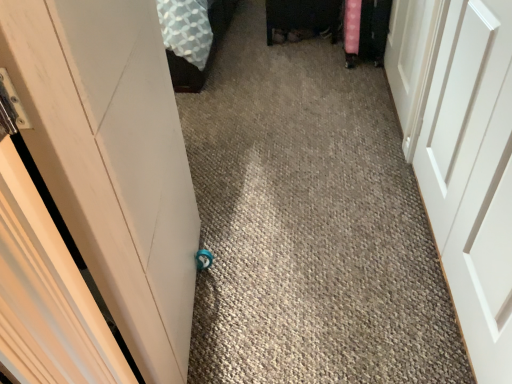
Where is `white matte door at center, which appears as the second door when viewed from the right`? The image size is (512, 384). white matte door at center, which appears as the second door when viewed from the right is located at coordinates (473, 176).

The width and height of the screenshot is (512, 384). What are the coordinates of `white matte door at left, arranged as the 3th door when viewed from the right` in the screenshot? It's located at (113, 160).

The image size is (512, 384). Describe the element at coordinates (412, 61) in the screenshot. I see `white matte door at right, which is the 3th door from left to right` at that location.

Identify the location of white matte door at center, which appears as the second door when viewed from the right. This screenshot has height=384, width=512. (473, 176).

Is white matte door at left, positioned as the first door in left-to-right order, located outside white matte door at right, which is counted as the 1th door, starting from the right?

Yes.

Image resolution: width=512 pixels, height=384 pixels. I want to click on door that is the 2nd object above the white matte door at right, which is counted as the 1th door, starting from the right (from a real-world perspective), so click(x=113, y=160).

Would you consider white matte door at left, positioned as the first door in left-to-right order, to be distant from white matte door at right, which is the 3th door from left to right?

Indeed, white matte door at left, positioned as the first door in left-to-right order, is not near white matte door at right, which is the 3th door from left to right.

From a real-world perspective, which object rests below the other?

white matte door at right, which is the 3th door from left to right, from a real-world perspective.

From the picture: Is white matte door at right, which is the 3th door from left to right, at the left side of white matte door at left, positioned as the first door in left-to-right order?

No.

Considering the sizes of objects white matte door at right, which is the 3th door from left to right, and white matte door at left, arranged as the 3th door when viewed from the right, in the image provided, who is wider, white matte door at right, which is the 3th door from left to right, or white matte door at left, arranged as the 3th door when viewed from the right,?

With larger width is white matte door at left, arranged as the 3th door when viewed from the right.

From the image's perspective, is white matte door at right, which is the 3th door from left to right, under white matte door at left, positioned as the first door in left-to-right order?

Actually, white matte door at right, which is the 3th door from left to right, appears above white matte door at left, positioned as the first door in left-to-right order, in the image.

Between white matte door at center, which ranks as the 2th door in left-to-right order, and white matte door at right, which is the 3th door from left to right, which one is positioned in front?

white matte door at center, which ranks as the 2th door in left-to-right order, is closer to the camera.

Looking at this image, from a real-world perspective, between white matte door at center, which ranks as the 2th door in left-to-right order, and white matte door at right, which is counted as the 1th door, starting from the right, who is vertically lower?

From a 3D spatial view, white matte door at right, which is counted as the 1th door, starting from the right, is below.

Is white matte door at center, which ranks as the 2th door in left-to-right order, positioned with its back to white matte door at right, which is the 3th door from left to right?

No.

Could white matte door at center, which appears as the second door when viewed from the right, be considered to be inside white matte door at left, positioned as the first door in left-to-right order?

No, white matte door at center, which appears as the second door when viewed from the right, is located outside of white matte door at left, positioned as the first door in left-to-right order.

Is white matte door at left, arranged as the 3th door when viewed from the right, bigger than white matte door at center, which appears as the second door when viewed from the right?

Yes, white matte door at left, arranged as the 3th door when viewed from the right, is bigger than white matte door at center, which appears as the second door when viewed from the right.

Considering the sizes of objects white matte door at left, arranged as the 3th door when viewed from the right, and white matte door at center, which appears as the second door when viewed from the right, in the image provided, who is thinner, white matte door at left, arranged as the 3th door when viewed from the right, or white matte door at center, which appears as the second door when viewed from the right,?

white matte door at center, which appears as the second door when viewed from the right.

Identify the location of door on the left of white matte door at center, which appears as the second door when viewed from the right. (113, 160).

Is white matte door at right, which is counted as the 1th door, starting from the right, next to white matte door at center, which ranks as the 2th door in left-to-right order, and touching it?

No, white matte door at right, which is counted as the 1th door, starting from the right, is not touching white matte door at center, which ranks as the 2th door in left-to-right order.

Is white matte door at right, which is counted as the 1th door, starting from the right, surrounding white matte door at center, which ranks as the 2th door in left-to-right order?

Actually, white matte door at center, which ranks as the 2th door in left-to-right order, is outside white matte door at right, which is counted as the 1th door, starting from the right.

Locate an element on the screen. The image size is (512, 384). door on the right side of white matte door at center, which appears as the second door when viewed from the right is located at coordinates (412, 61).

Could you tell me if white matte door at center, which appears as the second door when viewed from the right, is facing white matte door at left, arranged as the 3th door when viewed from the right?

Yes, white matte door at center, which appears as the second door when viewed from the right, is oriented towards white matte door at left, arranged as the 3th door when viewed from the right.

From the image's perspective, is white matte door at center, which ranks as the 2th door in left-to-right order, positioned above or below white matte door at left, arranged as the 3th door when viewed from the right?

Based on their image positions, white matte door at center, which ranks as the 2th door in left-to-right order, is located above white matte door at left, arranged as the 3th door when viewed from the right.

Would you consider white matte door at center, which ranks as the 2th door in left-to-right order, to be distant from white matte door at left, arranged as the 3th door when viewed from the right?

No.

Does white matte door at center, which ranks as the 2th door in left-to-right order, appear on the left side of white matte door at left, positioned as the first door in left-to-right order?

No.

The height and width of the screenshot is (384, 512). I want to click on the 2nd door to the right of the white matte door at left, positioned as the first door in left-to-right order, counting from the anchor's position, so click(412, 61).

From a real-world perspective, count 2nd doors downward from the white matte door at left, arranged as the 3th door when viewed from the right, and point to it. Please provide its 2D coordinates.

[(412, 61)]

Based on their spatial positions, is white matte door at left, positioned as the first door in left-to-right order, or white matte door at center, which appears as the second door when viewed from the right, further from white matte door at right, which is the 3th door from left to right?

white matte door at left, positioned as the first door in left-to-right order, lies further to white matte door at right, which is the 3th door from left to right, than the other object.

Which object lies further to the anchor point white matte door at center, which ranks as the 2th door in left-to-right order, white matte door at left, arranged as the 3th door when viewed from the right, or white matte door at right, which is counted as the 1th door, starting from the right?

The object further to white matte door at center, which ranks as the 2th door in left-to-right order, is white matte door at left, arranged as the 3th door when viewed from the right.

From the image, which object appears to be nearer to white matte door at left, arranged as the 3th door when viewed from the right, white matte door at center, which ranks as the 2th door in left-to-right order, or white matte door at right, which is the 3th door from left to right?

white matte door at center, which ranks as the 2th door in left-to-right order, is positioned closer to the anchor white matte door at left, arranged as the 3th door when viewed from the right.

Looking at the image, which one is located closer to white matte door at left, positioned as the first door in left-to-right order, white matte door at right, which is the 3th door from left to right, or white matte door at center, which appears as the second door when viewed from the right?

white matte door at center, which appears as the second door when viewed from the right, is positioned closer to the anchor white matte door at left, positioned as the first door in left-to-right order.

Looking at the image, which one is located further to white matte door at center, which ranks as the 2th door in left-to-right order, white matte door at right, which is counted as the 1th door, starting from the right, or white matte door at left, positioned as the first door in left-to-right order?

white matte door at left, positioned as the first door in left-to-right order.

When comparing their distances from white matte door at right, which is counted as the 1th door, starting from the right, does white matte door at center, which ranks as the 2th door in left-to-right order, or white matte door at left, arranged as the 3th door when viewed from the right, seem further?

white matte door at left, arranged as the 3th door when viewed from the right, lies further to white matte door at right, which is counted as the 1th door, starting from the right, than the other object.

I want to click on door positioned between white matte door at left, arranged as the 3th door when viewed from the right, and white matte door at right, which is the 3th door from left to right, from near to far, so click(x=473, y=176).